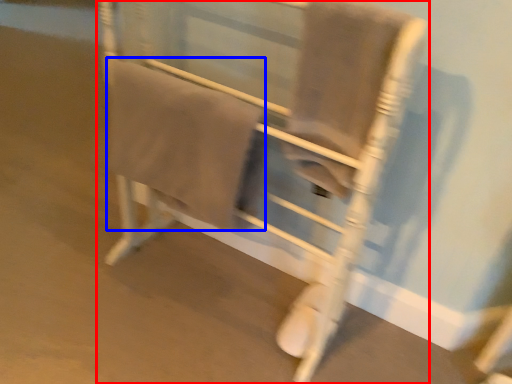
Question: Which of the following is the farthest to the observer, furniture (highlighted by a red box) or bath towel (highlighted by a blue box)?

Choices:
 (A) furniture
 (B) bath towel

Answer: (B)